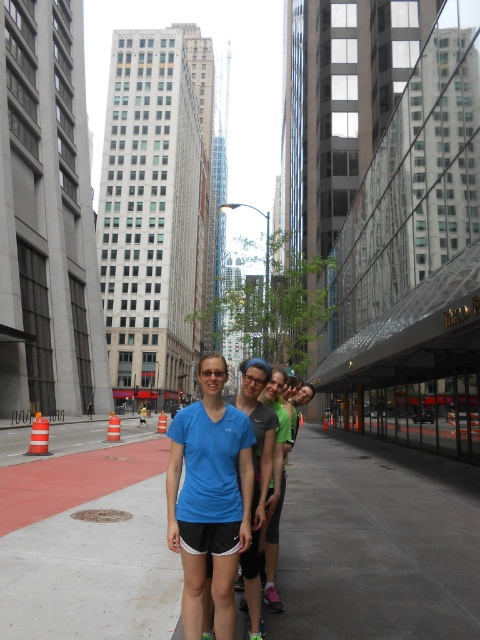
You are a city planner analyzing the layout of this urban scene. The gray concrete pavement at center is part of the sidewalk. Based on its coordinates, how would you describe its position relative to the buildings and the street?

The gray concrete pavement at center is located at coordinates point [376,544], which places it towards the lower right portion of the image, likely positioned at the edge of the sidewalk near the street, between the buildings.

You are a photographer trying to capture a photo of the gray concrete pavement at center and the blue fabric shorts at center. Which object should you focus on first if you want to ensure both are in focus without adjusting the camera settings?

The gray concrete pavement at center is much taller than the blue fabric shorts at center, so focusing on the gray concrete pavement at center first would ensure both are in focus since it is farther away.